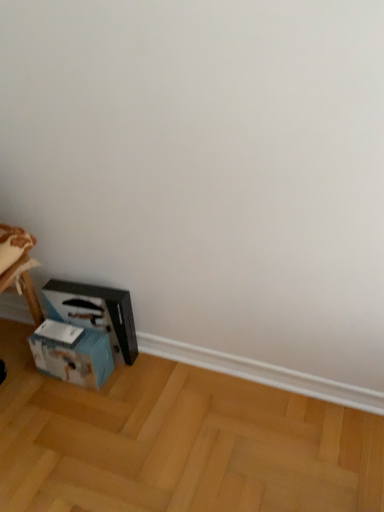
This screenshot has width=384, height=512. What do you see at coordinates (84, 333) in the screenshot? I see `black plastic workbench at lower left` at bounding box center [84, 333].

Where is `blue cardboard box at lower left`? blue cardboard box at lower left is located at coordinates (72, 353).

This screenshot has width=384, height=512. I want to click on light brown wooden floor at lower left, so click(x=178, y=442).

Is blue cardboard box at lower left facing towards black plastic workbench at lower left?

No, blue cardboard box at lower left is not turned towards black plastic workbench at lower left.

Which is correct: blue cardboard box at lower left is inside black plastic workbench at lower left, or outside of it?

blue cardboard box at lower left is not enclosed by black plastic workbench at lower left.

From a real-world perspective, relative to black plastic workbench at lower left, is blue cardboard box at lower left vertically above or below?

From a real-world perspective, blue cardboard box at lower left is physically below black plastic workbench at lower left.

Does blue cardboard box at lower left appear on the left side of black plastic workbench at lower left?

Yes, blue cardboard box at lower left is to the left of black plastic workbench at lower left.

Considering the positions of objects black plastic workbench at lower left and light brown wooden floor at lower left in the image provided, who is more to the left, black plastic workbench at lower left or light brown wooden floor at lower left?

black plastic workbench at lower left is more to the left.

Is the position of black plastic workbench at lower left less distant than that of light brown wooden floor at lower left?

No, it is behind light brown wooden floor at lower left.

Is black plastic workbench at lower left far from light brown wooden floor at lower left?

black plastic workbench at lower left is actually quite close to light brown wooden floor at lower left.

Does black plastic workbench at lower left have a lesser height compared to light brown wooden floor at lower left?

Incorrect, the height of black plastic workbench at lower left does not fall short of that of light brown wooden floor at lower left.

From the image's perspective, which one is positioned higher, blue cardboard box at lower left or light brown wooden floor at lower left?

blue cardboard box at lower left.

Is blue cardboard box at lower left not within light brown wooden floor at lower left?

Yes, blue cardboard box at lower left is not within light brown wooden floor at lower left.

Are blue cardboard box at lower left and light brown wooden floor at lower left far apart?

blue cardboard box at lower left is near light brown wooden floor at lower left, not far away.

Could you tell me if blue cardboard box at lower left is facing light brown wooden floor at lower left?

No, blue cardboard box at lower left is not oriented towards light brown wooden floor at lower left.

Could you tell me if light brown wooden floor at lower left is facing blue cardboard box at lower left?

No, light brown wooden floor at lower left is not oriented towards blue cardboard box at lower left.

Is light brown wooden floor at lower left placed right next to blue cardboard box at lower left?

light brown wooden floor at lower left is not next to blue cardboard box at lower left, and they're not touching.

Is light brown wooden floor at lower left bigger than blue cardboard box at lower left?

Correct, light brown wooden floor at lower left is larger in size than blue cardboard box at lower left.

Which is more distant, (314, 503) or (106, 334)?

Positioned behind is point (106, 334).

Measure the distance from light brown wooden floor at lower left to black plastic workbench at lower left.

light brown wooden floor at lower left and black plastic workbench at lower left are 11.88 inches apart from each other.

Can you confirm if light brown wooden floor at lower left is bigger than black plastic workbench at lower left?

Yes.

Based on the photo, from the image's perspective, is light brown wooden floor at lower left under black plastic workbench at lower left?

Yes, from the image's perspective, light brown wooden floor at lower left is beneath black plastic workbench at lower left.

What's the angular difference between light brown wooden floor at lower left and black plastic workbench at lower left's facing directions?

The angular difference between light brown wooden floor at lower left and black plastic workbench at lower left is 96.1 degrees.

Is black plastic workbench at lower left facing away from blue cardboard box at lower left?

Yes.

In the scene shown: Is black plastic workbench at lower left touching blue cardboard box at lower left?

Yes, black plastic workbench at lower left and blue cardboard box at lower left clearly make contact.

Does black plastic workbench at lower left have a greater width compared to blue cardboard box at lower left?

In fact, black plastic workbench at lower left might be narrower than blue cardboard box at lower left.

This screenshot has height=512, width=384. Find the location of `box below the black plastic workbench at lower left (from the image's perspective)`. box below the black plastic workbench at lower left (from the image's perspective) is located at coordinates (72, 353).

Identify the location of workbench above the blue cardboard box at lower left (from a real-world perspective). The height and width of the screenshot is (512, 384). (84, 333).

Image resolution: width=384 pixels, height=512 pixels. Identify the location of workbench behind the light brown wooden floor at lower left. (84, 333).

Considering their positions, is blue cardboard box at lower left positioned closer to light brown wooden floor at lower left than black plastic workbench at lower left?

black plastic workbench at lower left.

Based on their spatial positions, is black plastic workbench at lower left or light brown wooden floor at lower left further from blue cardboard box at lower left?

light brown wooden floor at lower left is positioned further to the anchor blue cardboard box at lower left.

Based on their spatial positions, is blue cardboard box at lower left or light brown wooden floor at lower left closer to black plastic workbench at lower left?

The object closer to black plastic workbench at lower left is blue cardboard box at lower left.

Estimate the real-world distances between objects in this image. Which object is further from blue cardboard box at lower left, light brown wooden floor at lower left or black plastic workbench at lower left?

light brown wooden floor at lower left lies further to blue cardboard box at lower left than the other object.

Estimate the real-world distances between objects in this image. Which object is closer to light brown wooden floor at lower left, black plastic workbench at lower left or blue cardboard box at lower left?

black plastic workbench at lower left.

Which object lies nearer to the anchor point black plastic workbench at lower left, light brown wooden floor at lower left or blue cardboard box at lower left?

blue cardboard box at lower left.

This screenshot has width=384, height=512. I want to click on box positioned between light brown wooden floor at lower left and black plastic workbench at lower left from near to far, so click(x=72, y=353).